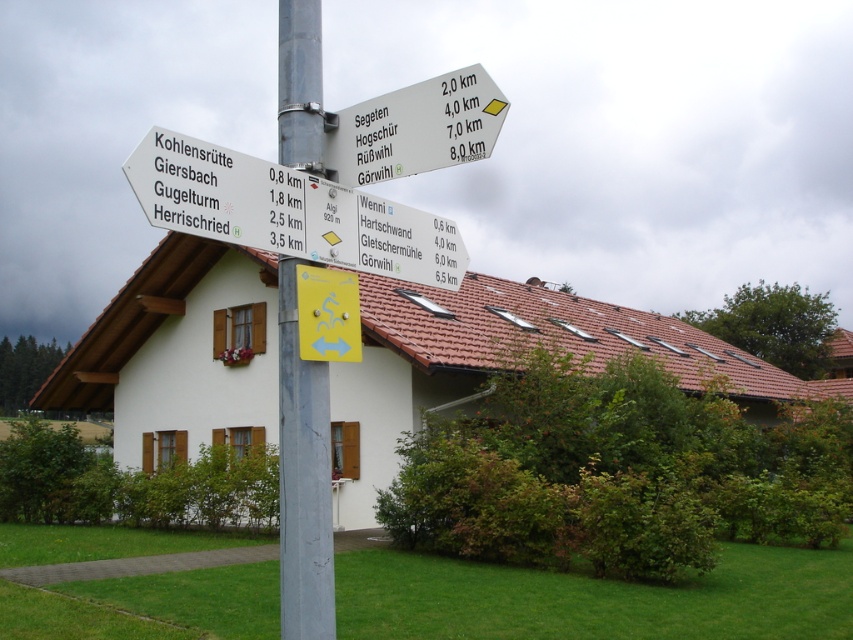
Question: Which point appears farthest from the camera in this image?

Choices:
 (A) (287, 68)
 (B) (477, 148)
 (C) (209, 177)

Answer: (A)

Question: Among these points, which one is nearest to the camera?

Choices:
 (A) (415, 93)
 (B) (189, 225)
 (C) (279, 547)

Answer: (B)

Question: Which of the following is the closest to the observer?

Choices:
 (A) coord(305,10)
 (B) coord(457,278)

Answer: (A)

Question: Is the position of metallic pole at center more distant than that of white plastic signpost at upper center?

Choices:
 (A) no
 (B) yes

Answer: (A)

Question: Can you confirm if metallic pole at center is thinner than white plastic signpost at upper center?

Choices:
 (A) yes
 (B) no

Answer: (A)

Question: Does metallic pole at center have a lesser width compared to white plastic signpost at upper center?

Choices:
 (A) yes
 (B) no

Answer: (A)